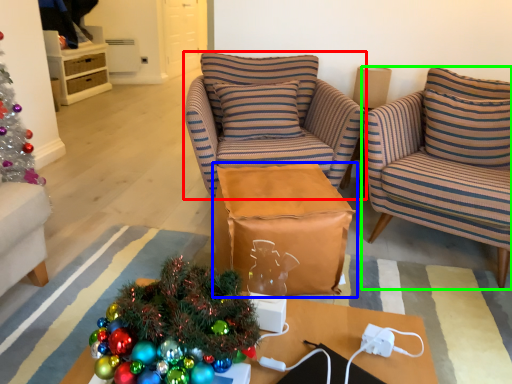
Question: Considering the real-world distances, which object is farthest from chair (highlighted by a red box)? table (highlighted by a blue box) or chair (highlighted by a green box)?

Choices:
 (A) table
 (B) chair

Answer: (B)